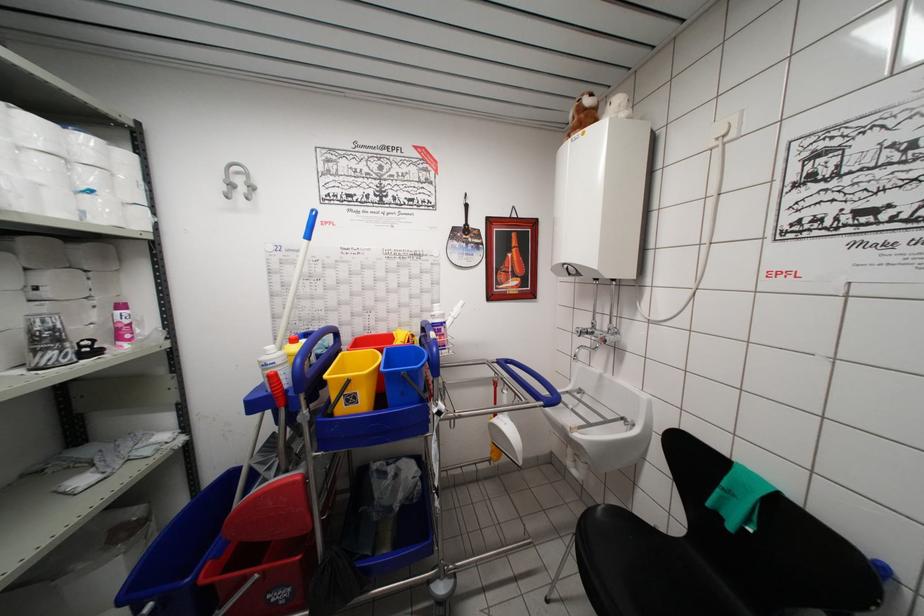
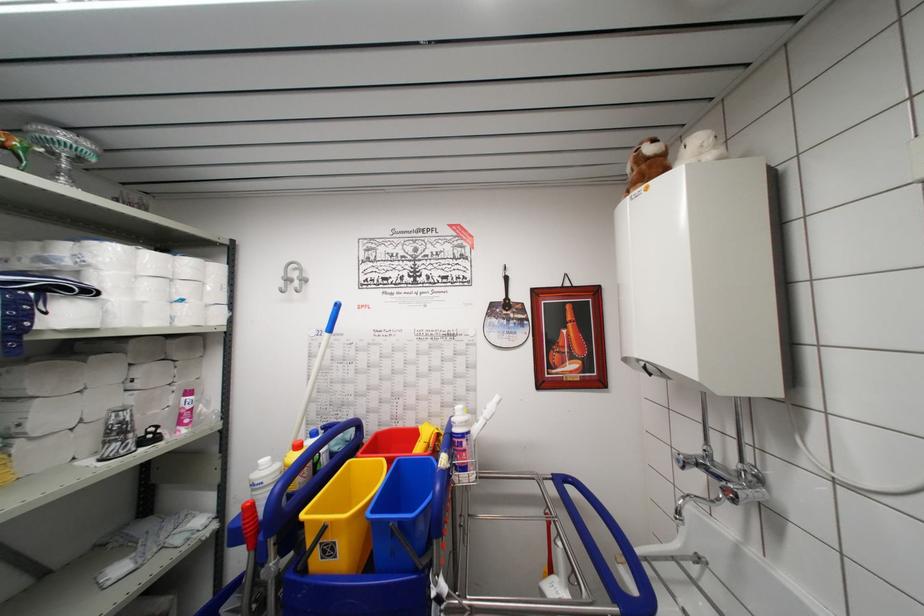
Where in the second image is the point corresponding to [349,410] from the first image?

(325, 562)